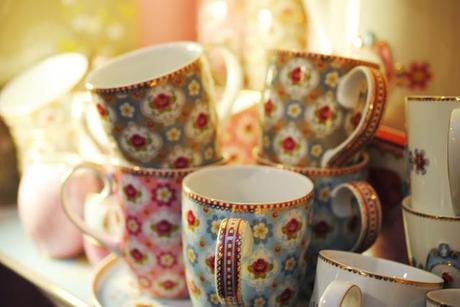
Identify the location of mug. This screenshot has height=307, width=460. (180, 104), (161, 224), (201, 231), (287, 128), (312, 178), (428, 140), (428, 227), (398, 292).